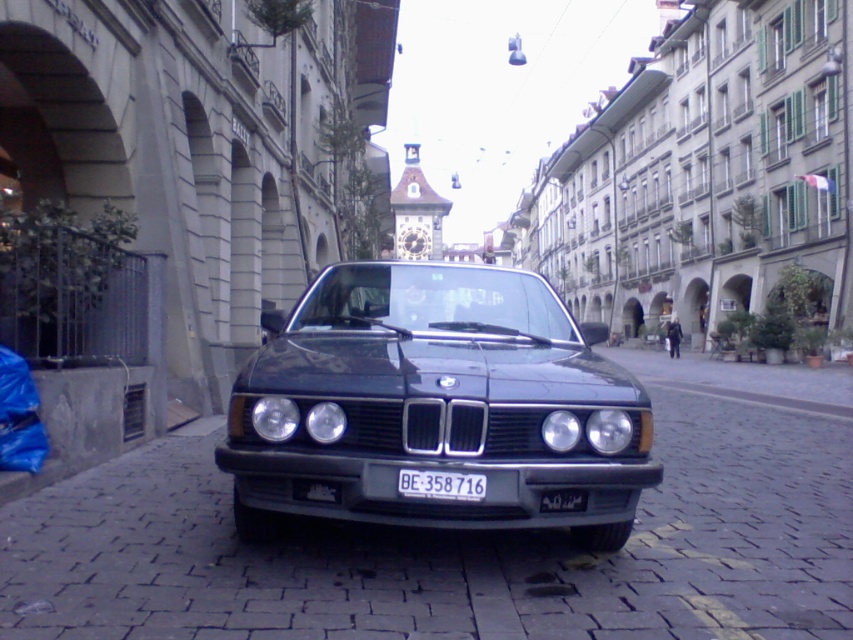
Question: Which object is positioned closest to the white plastic license plate at center?

Choices:
 (A) matte black car at center
 (B) shiny dark green car at center

Answer: (B)

Question: Which point appears farthest from the camera in this image?

Choices:
 (A) (331, 342)
 (B) (167, 532)
 (C) (477, 484)

Answer: (B)

Question: Which of these objects is positioned closest to the shiny dark green car at center?

Choices:
 (A) white plastic license plate at center
 (B) matte black car at center

Answer: (A)

Question: Is shiny dark green car at center thinner than white plastic license plate at center?

Choices:
 (A) yes
 (B) no

Answer: (B)

Question: Can you confirm if matte black car at center is wider than shiny dark green car at center?

Choices:
 (A) no
 (B) yes

Answer: (B)

Question: Can you confirm if matte black car at center is wider than white plastic license plate at center?

Choices:
 (A) yes
 (B) no

Answer: (A)